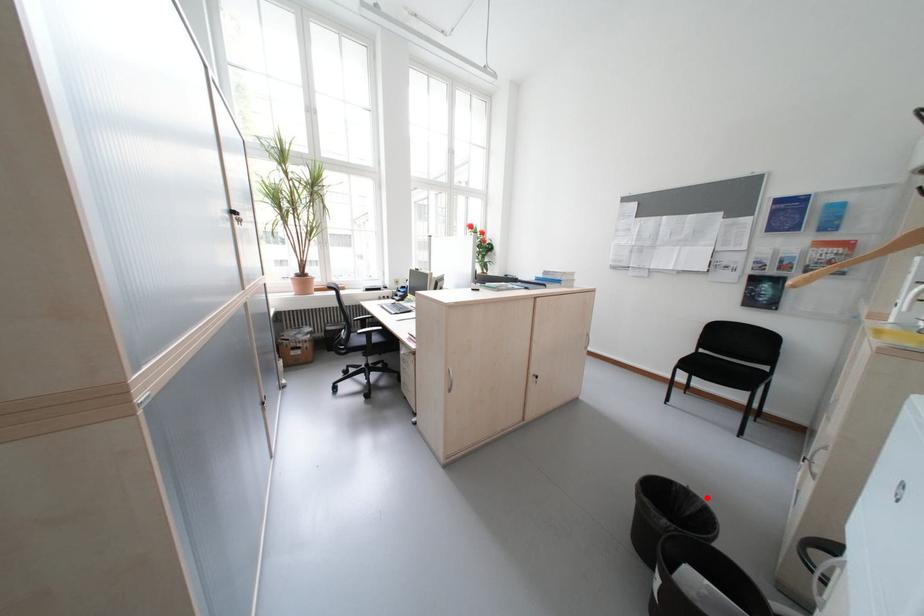
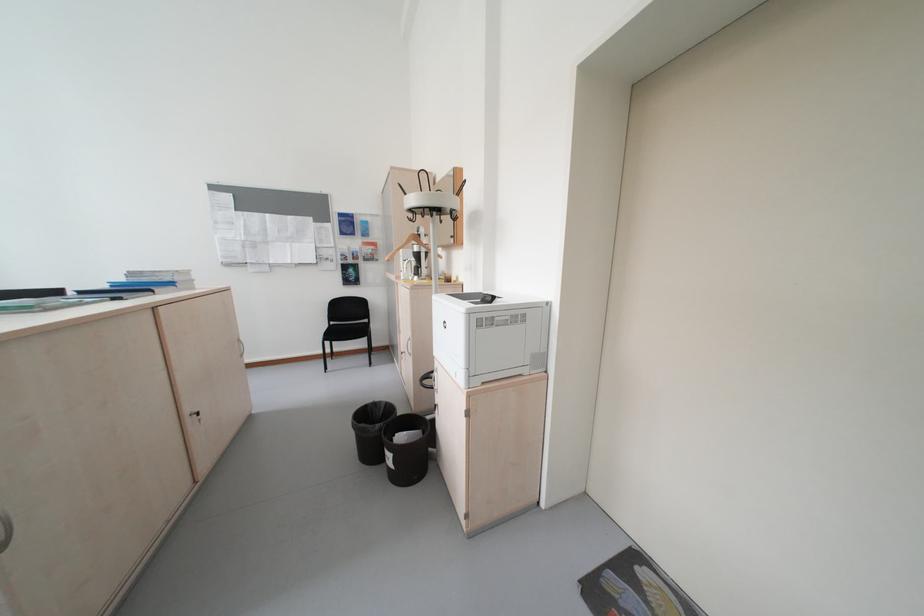
Question: I am providing you with two images of the same scene from different viewpoints. Given a red point in image1, look at the same physical point in image2. Is it:

Choices:
 (A) Closer to the viewpoint
 (B) Farther from the viewpoint

Answer: (A)